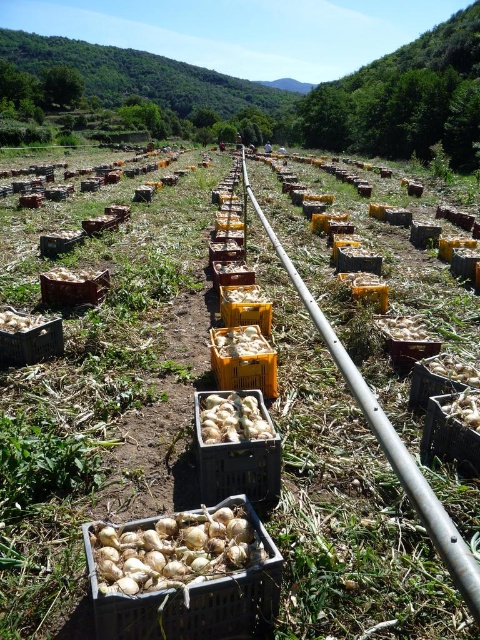
Question: Does black plastic crate at lower right have a lesser width compared to brown plastic basket at lower left?

Choices:
 (A) yes
 (B) no

Answer: (A)

Question: Can you confirm if white matte onion at center is bigger than wooden crate at lower left?

Choices:
 (A) yes
 (B) no

Answer: (B)

Question: Which point appears closest to the camera in this image?

Choices:
 (A) (255, 422)
 (B) (170, 593)
 (C) (247, 337)
 (D) (12, 346)

Answer: (B)

Question: Which object is positioned farthest from the yellow plastic crate at center?

Choices:
 (A) white plastic crate at center
 (B) brown woven basket at lower right

Answer: (B)

Question: Is wooden crate at lower left thinner than brown plastic basket at lower left?

Choices:
 (A) no
 (B) yes

Answer: (B)

Question: Which point is closer to the camera?

Choices:
 (A) brown plastic basket at lower left
 (B) white matte onion at center

Answer: (B)